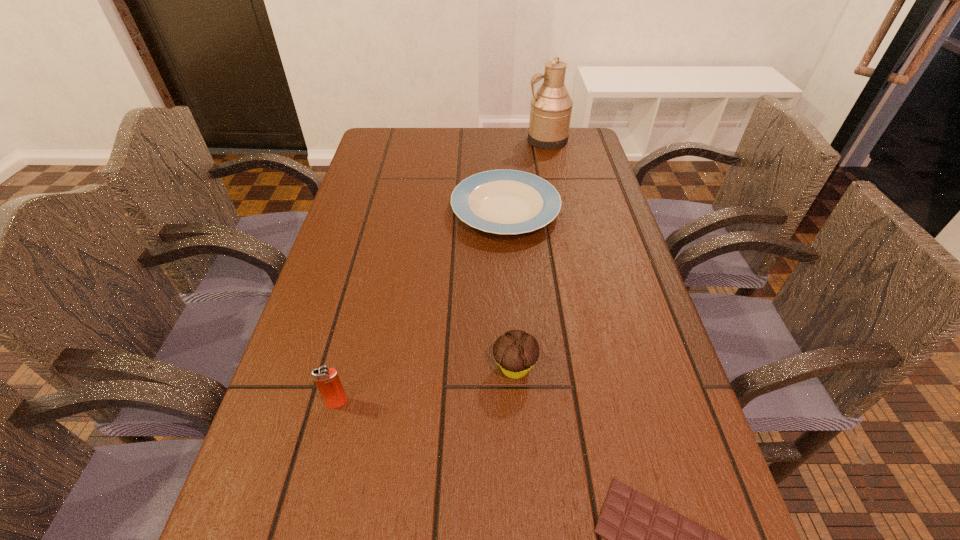
Find the location of a particular element. This screenshot has height=540, width=960. the farthest object is located at coordinates (550, 113).

The width and height of the screenshot is (960, 540). What are the coordinates of `pitcher` in the screenshot? It's located at (550, 113).

Where is `the second nearest object`? the second nearest object is located at coordinates (327, 380).

At what (x,y) coordinates should I click in order to perform the action: click on igniter. Please return your answer as a coordinate pair (x, y). The width and height of the screenshot is (960, 540). Looking at the image, I should click on (327, 380).

You are a GUI agent. You are given a task and a screenshot of the screen. Output one action in this format:
    pyautogui.click(x=<x>, y=<y>)
    Task: Click on the third nearest object
    Image resolution: width=960 pixels, height=540 pixels.
    Given the screenshot: What is the action you would take?
    pyautogui.click(x=516, y=352)

Locate an element on the screen. The height and width of the screenshot is (540, 960). the third shortest object is located at coordinates (516, 352).

Locate an element on the screen. The height and width of the screenshot is (540, 960). plate is located at coordinates (497, 201).

Identify the location of the second farthest object. pos(497,201).

I want to click on free spot located on the left of the pitcher, so click(466, 139).

Where is `free space located 0.230m on the back of the igniter`? This screenshot has height=540, width=960. free space located 0.230m on the back of the igniter is located at coordinates (362, 302).